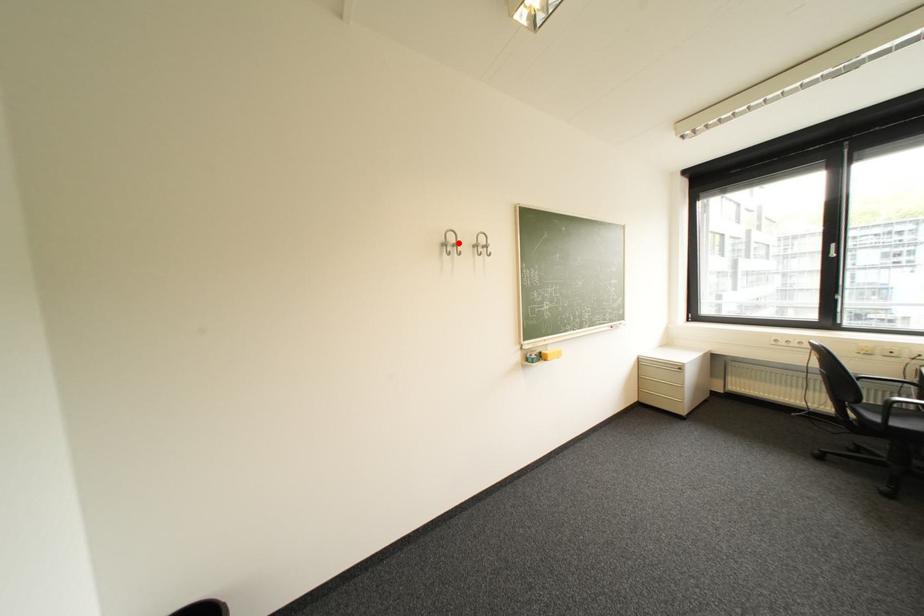
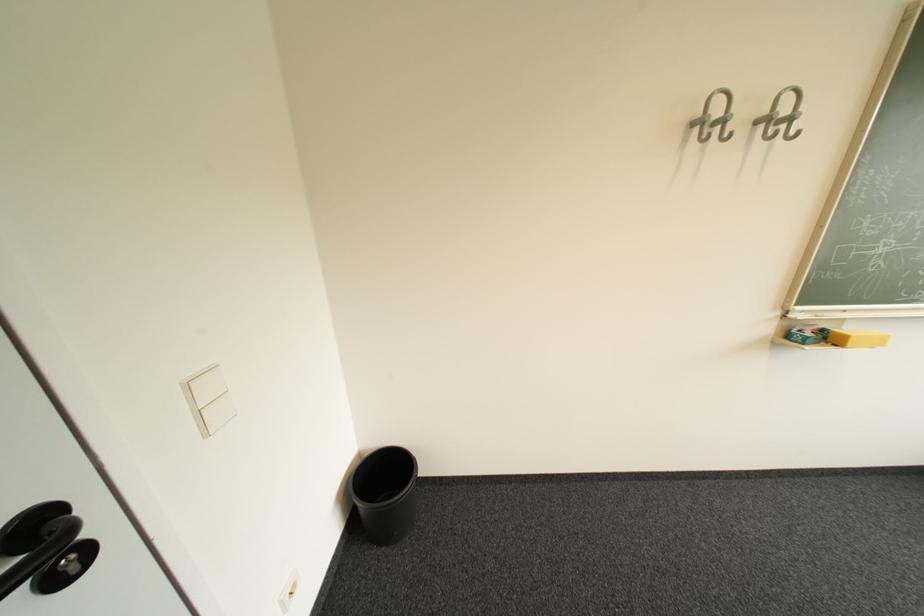
In the second image, find the point that corresponds to the highlighted location in the first image.

(720, 116)